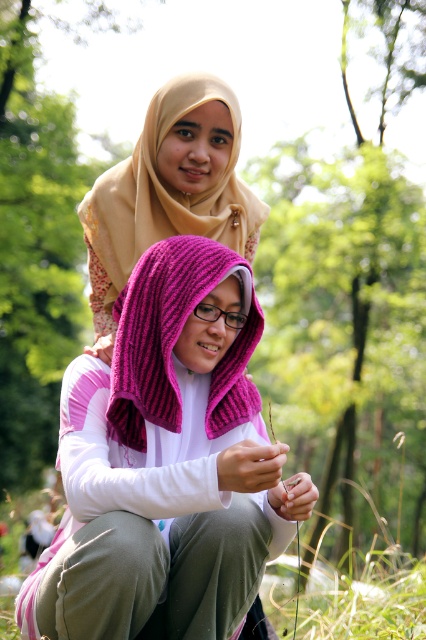
Can you confirm if fuchsia knitted shawl at lower center is positioned above beige soft scarf at upper center?

No, fuchsia knitted shawl at lower center is not above beige soft scarf at upper center.

From the picture: Does fuchsia knitted shawl at lower center have a greater width compared to beige soft scarf at upper center?

Incorrect, fuchsia knitted shawl at lower center's width does not surpass beige soft scarf at upper center's.

Is point (118, 301) closer to viewer compared to point (147, 186)?

Yes, it is.

Locate an element on the screen. The height and width of the screenshot is (640, 426). fuchsia knitted shawl at lower center is located at coordinates (158, 332).